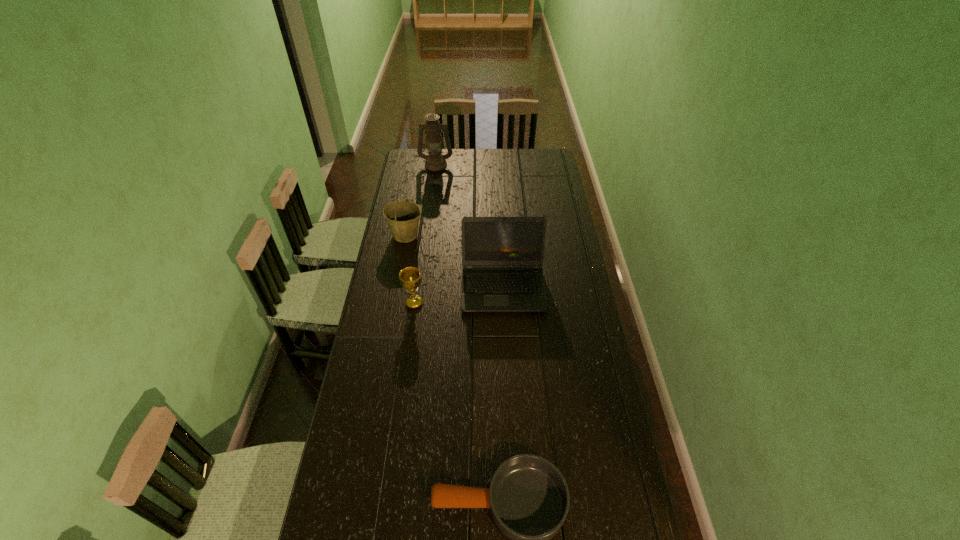
Locate an element on the screen. The image size is (960, 540). oil lamp is located at coordinates (435, 161).

Locate an element on the screen. This screenshot has width=960, height=540. the tallest object is located at coordinates (435, 161).

The height and width of the screenshot is (540, 960). Identify the location of laptop_computer. (502, 257).

Identify the location of wine bucket. (402, 216).

Find the location of a particular element. the fourth tallest object is located at coordinates (410, 278).

I want to click on vacant area located on the right of the tallest object, so click(471, 164).

Where is `vacant position located on the screen of the laptop_computer`? vacant position located on the screen of the laptop_computer is located at coordinates (508, 383).

Locate an element on the screen. free space located on the back of the wine bucket is located at coordinates (410, 209).

What are the coordinates of `free point located on the front of the chalice` in the screenshot? It's located at (405, 367).

The width and height of the screenshot is (960, 540). I want to click on object that is at the far edge, so click(435, 161).